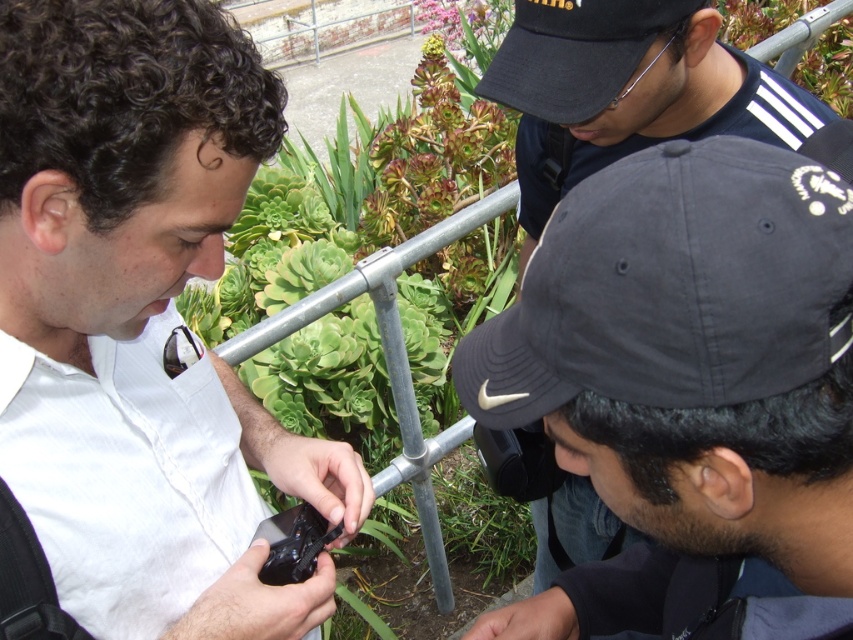
You are a photographer trying to capture a photo of the two people wearing baseball caps in the scene. The camera you are using has a maximum focus range of 18 inches. Can you capture both the dark gray fabric baseball cap at center and the black matte baseball cap at upper right in focus without moving the camera?

The distance between the dark gray fabric baseball cap at center and the black matte baseball cap at upper right is 17.69 inches, which is within the camera maximum focus range of 18 inches. Therefore, you can capture both in focus without moving the camera.